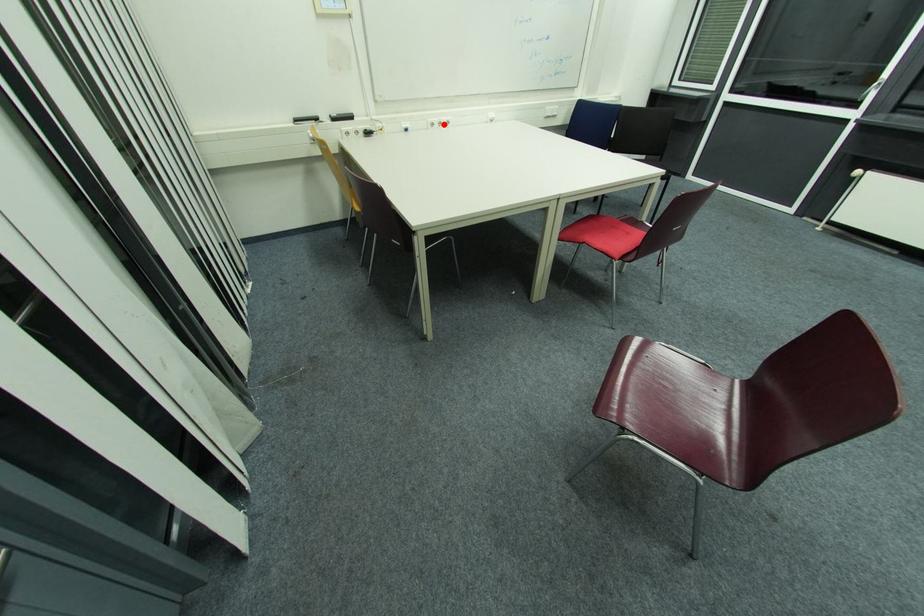
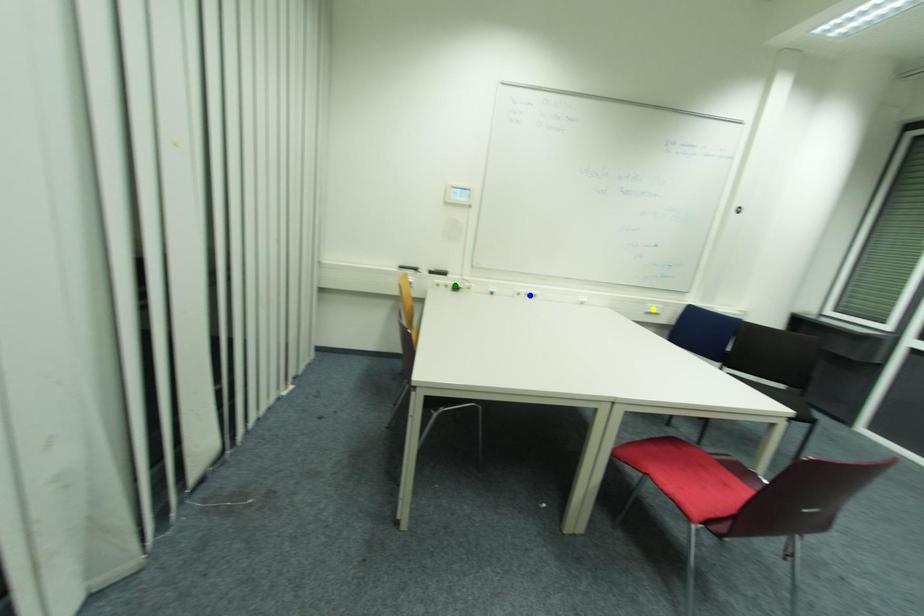
Question: I am providing you with two images of the same scene from different viewpoints. A red point is marked on the first image. You are given multiple points on the second image. Can you choose the point in image 2 that corresponds to the point in image 1?

Choices:
 (A) green point
 (B) yellow point
 (C) blue point

Answer: (C)